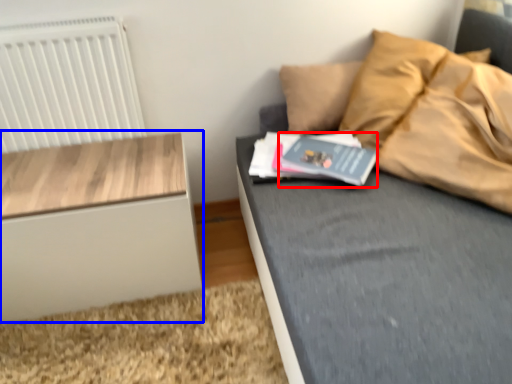
Question: Which of the following is the closest to the observer, paperback book (highlighted by a red box) or nightstand (highlighted by a blue box)?

Choices:
 (A) paperback book
 (B) nightstand

Answer: (B)